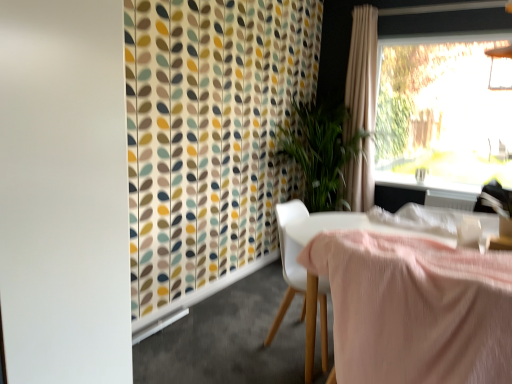
Question: In terms of height, does white matte screen door at left look taller or shorter compared to pink fabric-covered table at center?

Choices:
 (A) tall
 (B) short

Answer: (A)

Question: From a real-world perspective, is white matte screen door at left physically located above or below pink fabric-covered table at center?

Choices:
 (A) above
 (B) below

Answer: (A)

Question: Considering the real-world distances, which object is farthest from the beige fabric curtain at upper right?

Choices:
 (A) white plastic chair at center
 (B) white glossy window sill at upper right
 (C) pink fabric-covered table at center
 (D) transparent glass window at upper right
 (E) white matte screen door at left

Answer: (E)

Question: Which of these objects is positioned closest to the white plastic chair at center?

Choices:
 (A) transparent glass window at upper right
 (B) white glossy window sill at upper right
 (C) pink fabric-covered table at center
 (D) beige fabric curtain at upper right
 (E) white matte screen door at left

Answer: (C)